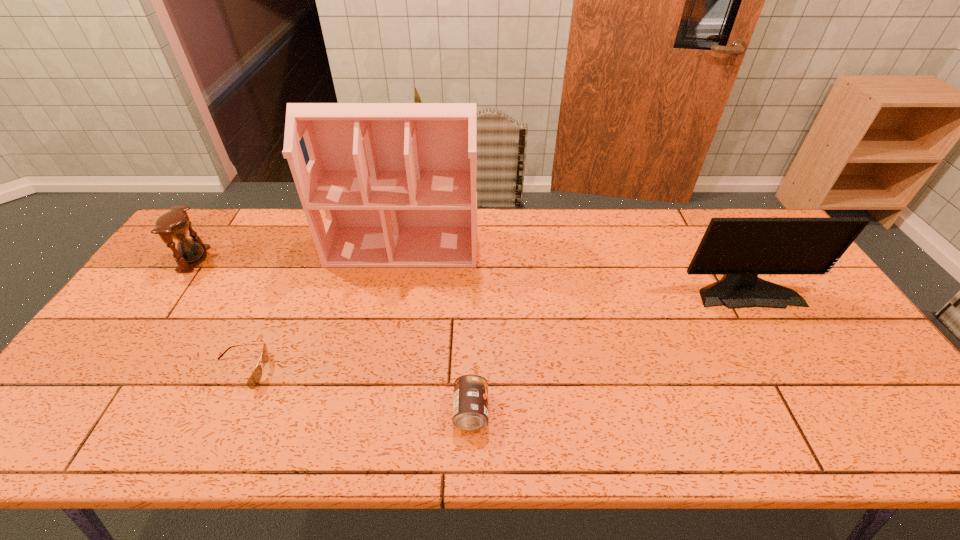
Find the location of a particular element. The width and height of the screenshot is (960, 540). free space located 0.150m on the right of the hourglass is located at coordinates (253, 259).

You are a GUI agent. You are given a task and a screenshot of the screen. Output one action in this format:
    pyautogui.click(x=<x>, y=<y>)
    Task: Click on the blank area located 0.070m on the front label of the can
    This screenshot has width=960, height=540.
    Given the screenshot: What is the action you would take?
    pyautogui.click(x=518, y=411)

Identify the location of blank space located on the front-facing side of the fourth object from right to left. (348, 372).

The width and height of the screenshot is (960, 540). I want to click on dollhouse that is at the far edge, so click(397, 181).

The image size is (960, 540). Identify the location of hourglass that is at the far edge. (174, 224).

Find the location of a particular element. This screenshot has height=540, width=960. object that is at the near edge is located at coordinates (470, 405).

You are a GUI agent. You are given a task and a screenshot of the screen. Output one action in this format:
    pyautogui.click(x=<x>, y=<y>)
    Task: Click on the object that is positioned at the left edge
    This screenshot has width=960, height=540.
    Given the screenshot: What is the action you would take?
    pyautogui.click(x=174, y=224)

You are a GUI agent. You are given a task and a screenshot of the screen. Output one action in this format:
    pyautogui.click(x=<x>, y=<y>)
    Task: Click on the object at the right edge
    This screenshot has width=960, height=540.
    Given the screenshot: What is the action you would take?
    pyautogui.click(x=740, y=249)

I want to click on object that is at the far left corner, so click(174, 224).

The width and height of the screenshot is (960, 540). I want to click on vacant region at the far edge, so click(x=693, y=245).